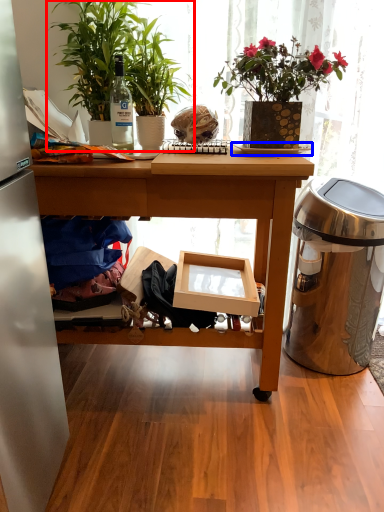
Question: Which object appears farthest to the camera in this image, houseplant (highlighted by a red box) or plate (highlighted by a blue box)?

Choices:
 (A) houseplant
 (B) plate

Answer: (B)